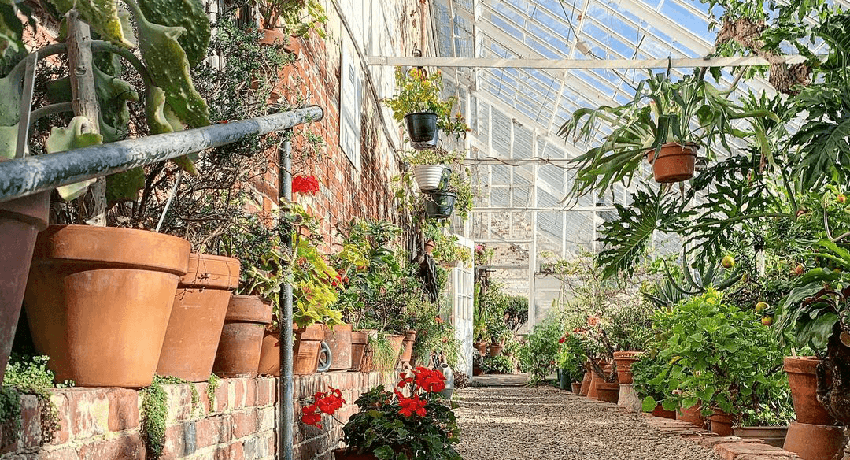
Where is `glass panel slanting ceiling`? This screenshot has width=850, height=460. glass panel slanting ceiling is located at coordinates (551, 29).